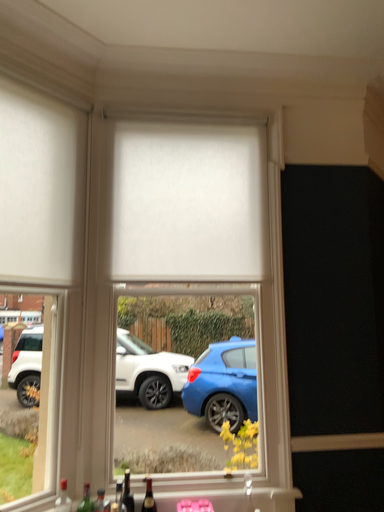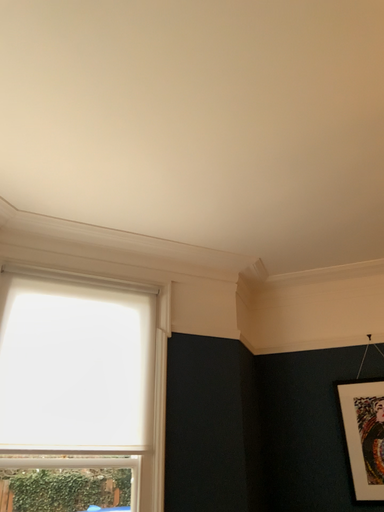
Question: How did the camera likely rotate when shooting the video?

Choices:
 (A) rotated upward
 (B) rotated downward

Answer: (A)